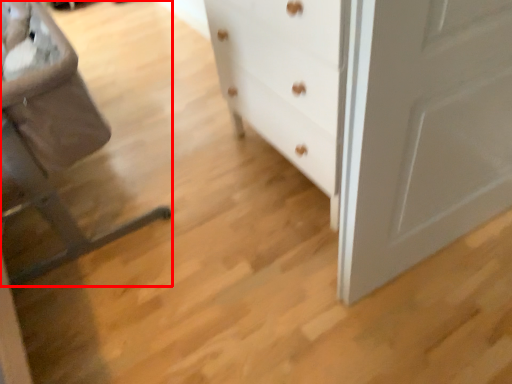
Question: From the image's perspective, considering the relative positions of rocking chair (annotated by the red box) and chest of drawers in the image provided, where is rocking chair (annotated by the red box) located with respect to the staircase?

Choices:
 (A) below
 (B) above

Answer: (A)